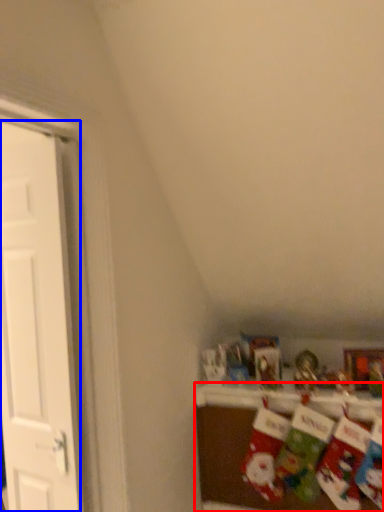
Question: Which point is closer to the camera, shelf (highlighted by a red box) or door (highlighted by a blue box)?

Choices:
 (A) shelf
 (B) door

Answer: (B)